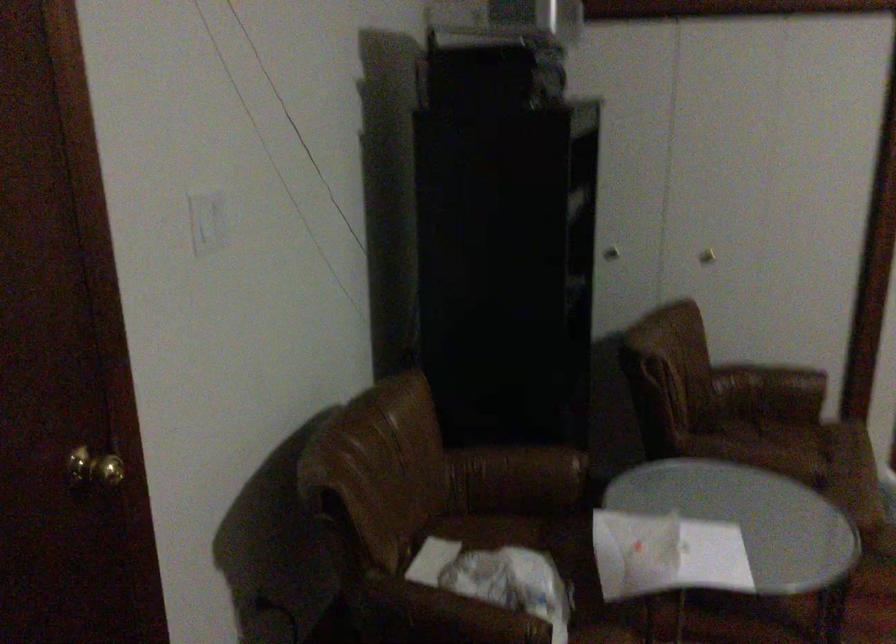
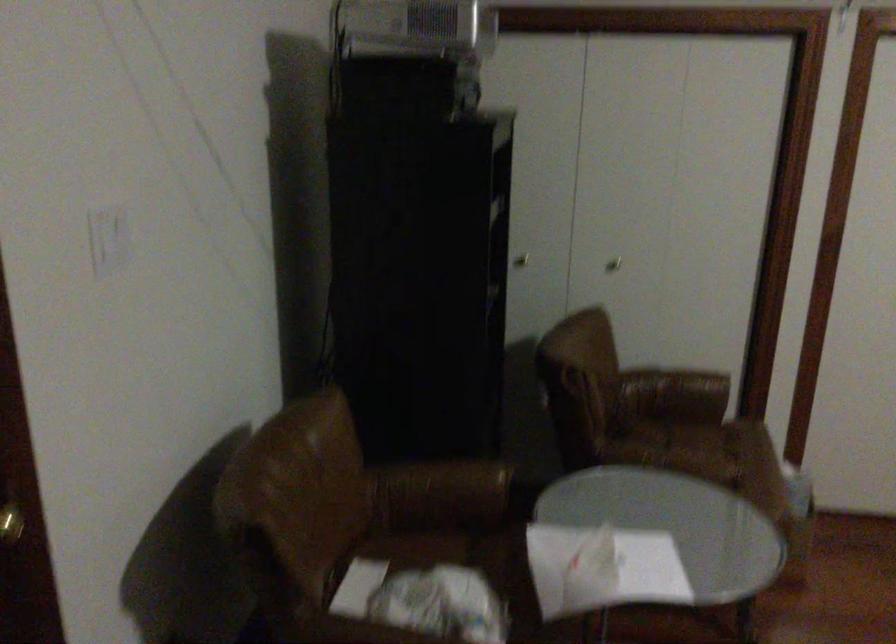
Find the pixel in the second image that matches (810,440) in the first image.

(718, 442)